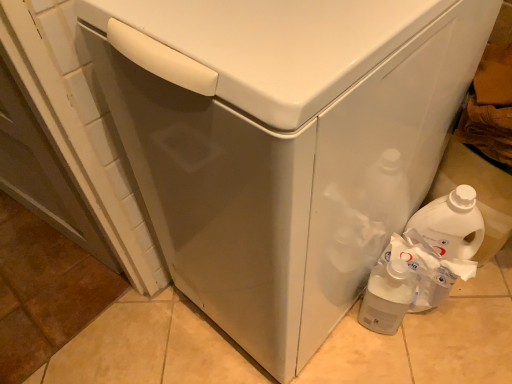
Identify the location of translucent plastic bottle at lower right. The height and width of the screenshot is (384, 512). (387, 297).

What do you see at coordinates (387, 297) in the screenshot?
I see `translucent plastic bottle at lower right` at bounding box center [387, 297].

Where is `translucent plastic bottle at lower right`? This screenshot has height=384, width=512. translucent plastic bottle at lower right is located at coordinates (387, 297).